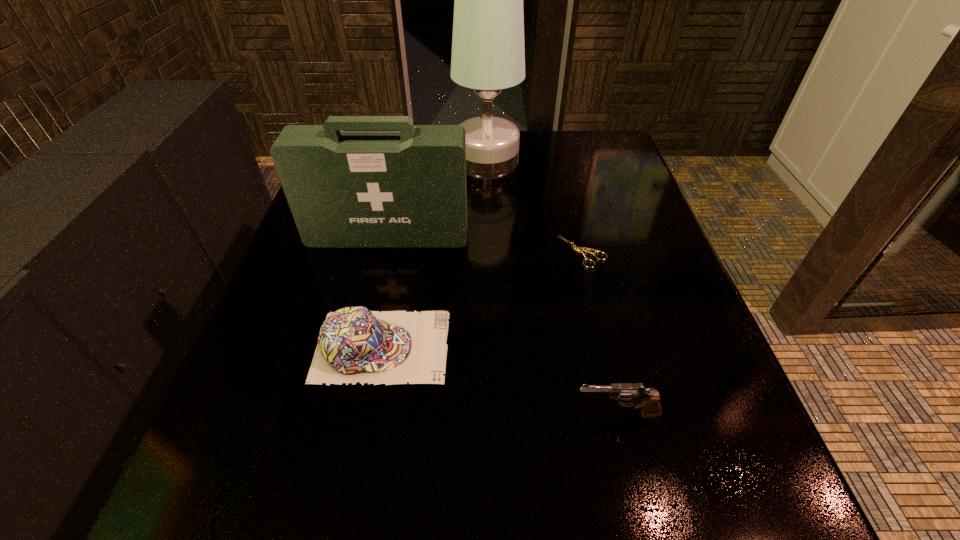
Find the location of a particular element. This screenshot has width=960, height=540. free space located at the barrel of the pistol is located at coordinates (391, 414).

Where is `free space located 0.170m at the barrel of the pistol`? This screenshot has width=960, height=540. free space located 0.170m at the barrel of the pistol is located at coordinates (454, 414).

Where is `free region located at the barrel of the pistol`? free region located at the barrel of the pistol is located at coordinates (461, 414).

What are the coordinates of `vacant space located 0.280m on the front, side, and top of the fourth farthest object` in the screenshot? It's located at (622, 347).

This screenshot has height=540, width=960. Find the location of `vacant position located on the left of the shears`. vacant position located on the left of the shears is located at coordinates (514, 252).

Image resolution: width=960 pixels, height=540 pixels. What are the coordinates of `object located in the far edge section of the desktop` in the screenshot? It's located at (488, 55).

Identify the location of the first-aid kit positioned at the left edge. This screenshot has height=540, width=960. (346, 189).

Identify the location of cap situated at the left edge. (355, 344).

Locate an element on the screen. This screenshot has height=540, width=960. pistol that is at the right edge is located at coordinates (648, 401).

The image size is (960, 540). In order to click on shears at the right edge in this screenshot , I will do `click(578, 249)`.